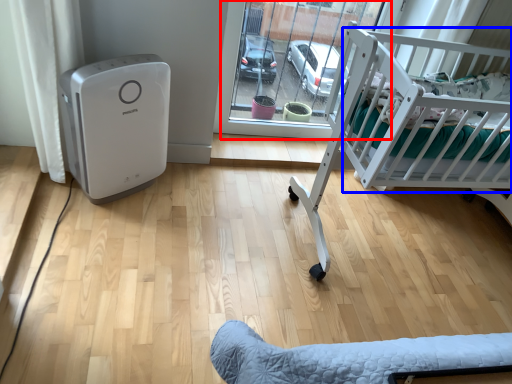
Question: Among these objects, which one is nearest to the camera, glass door (highlighted by a red box) or infant bed (highlighted by a blue box)?

Choices:
 (A) glass door
 (B) infant bed

Answer: (B)